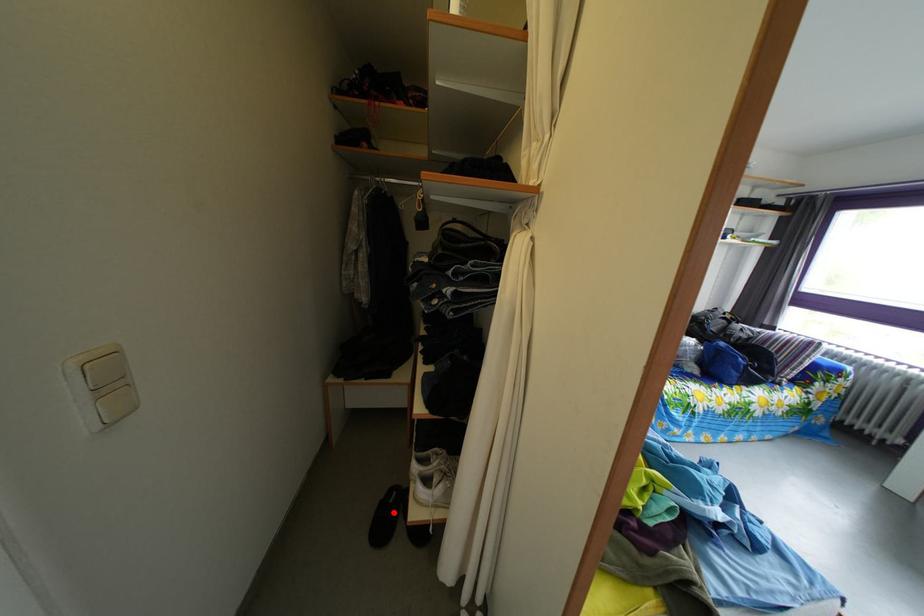
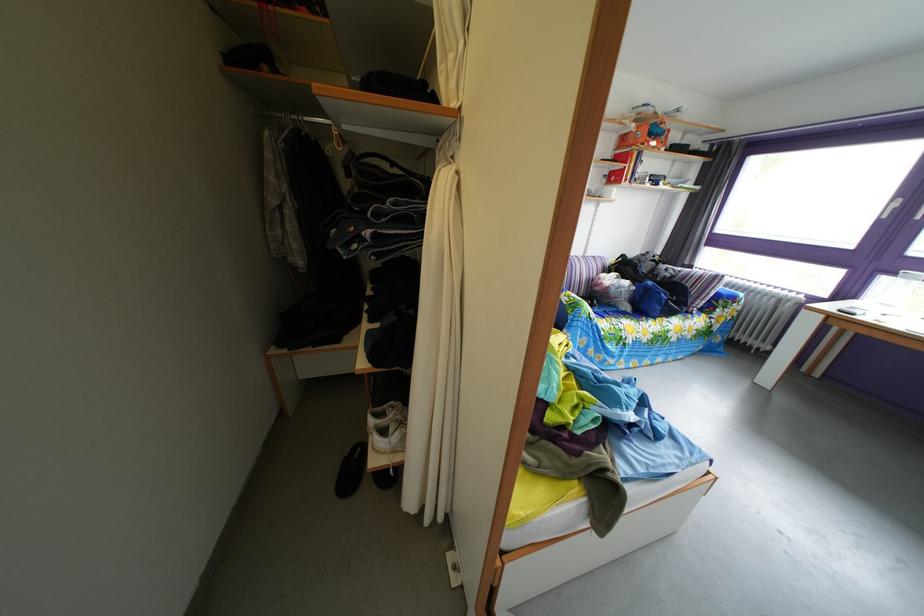
In the second image, find the point that corresponds to the highlighted location in the first image.

(359, 469)